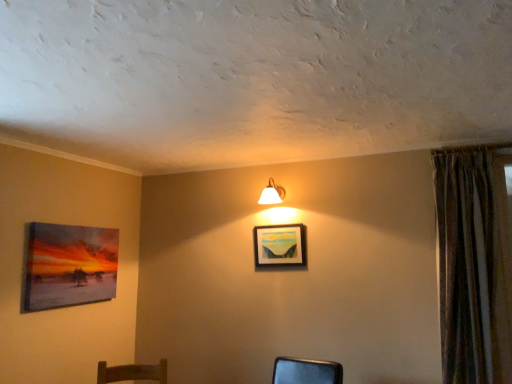
Image resolution: width=512 pixels, height=384 pixels. In order to click on white glossy wall lamp at upper center in this screenshot , I will do `click(272, 193)`.

Image resolution: width=512 pixels, height=384 pixels. Find the location of `matte wooden picture frame at center, which ranks as the first picture frame in right-to-left order`. matte wooden picture frame at center, which ranks as the first picture frame in right-to-left order is located at coordinates (280, 245).

What do you see at coordinates (471, 270) in the screenshot? I see `textured brown curtain at right` at bounding box center [471, 270].

Measure the distance between point (466,265) and camera.

A distance of 2.50 meters exists between point (466,265) and camera.

The image size is (512, 384). Find the location of `white glossy wall lamp at upper center`. white glossy wall lamp at upper center is located at coordinates [272, 193].

Does white glossy wall lamp at upper center have a smaller size compared to matte canvas painting at left, the 2th picture frame viewed from the right?

Yes, white glossy wall lamp at upper center is smaller than matte canvas painting at left, the 2th picture frame viewed from the right.

Where is `lamp that is behind the matte canvas painting at left, the 2th picture frame viewed from the right`? lamp that is behind the matte canvas painting at left, the 2th picture frame viewed from the right is located at coordinates (272, 193).

Which is behind, white glossy wall lamp at upper center or matte canvas painting at left, the 2th picture frame viewed from the right?

white glossy wall lamp at upper center is further from the camera.

Does white glossy wall lamp at upper center turn towards matte canvas painting at left, positioned as the 1th picture frame in left-to-right order?

No, white glossy wall lamp at upper center is not facing towards matte canvas painting at left, positioned as the 1th picture frame in left-to-right order.

The width and height of the screenshot is (512, 384). What are the coordinates of `picture frame above the matte canvas painting at left, positioned as the 1th picture frame in left-to-right order (from a real-world perspective)` in the screenshot? It's located at (280, 245).

Is matte wooden picture frame at center, the second picture frame in the left-to-right sequence, further to the viewer compared to matte canvas painting at left, the 2th picture frame viewed from the right?

Yes, the depth of matte wooden picture frame at center, the second picture frame in the left-to-right sequence, is greater than that of matte canvas painting at left, the 2th picture frame viewed from the right.

From the image's perspective, is matte wooden picture frame at center, the second picture frame in the left-to-right sequence, under matte canvas painting at left, the 2th picture frame viewed from the right?

No.

Is matte wooden picture frame at center, which ranks as the first picture frame in right-to-left order, located within matte canvas painting at left, the 2th picture frame viewed from the right?

No, matte wooden picture frame at center, which ranks as the first picture frame in right-to-left order, is located outside of matte canvas painting at left, the 2th picture frame viewed from the right.

Is matte canvas painting at left, the 2th picture frame viewed from the right, facing towards matte wooden picture frame at center, the second picture frame in the left-to-right sequence?

Yes, matte canvas painting at left, the 2th picture frame viewed from the right, is oriented towards matte wooden picture frame at center, the second picture frame in the left-to-right sequence.

Considering the sizes of objects matte canvas painting at left, the 2th picture frame viewed from the right, and matte wooden picture frame at center, which ranks as the first picture frame in right-to-left order, in the image provided, who is bigger, matte canvas painting at left, the 2th picture frame viewed from the right, or matte wooden picture frame at center, which ranks as the first picture frame in right-to-left order,?

With larger size is matte canvas painting at left, the 2th picture frame viewed from the right.

Is matte canvas painting at left, the 2th picture frame viewed from the right, thinner than matte wooden picture frame at center, the second picture frame in the left-to-right sequence?

No.

Based on their positions, is matte canvas painting at left, the 2th picture frame viewed from the right, located to the left or right of textured brown curtain at right?

Based on their positions, matte canvas painting at left, the 2th picture frame viewed from the right, is located to the left of textured brown curtain at right.

Does matte canvas painting at left, the 2th picture frame viewed from the right, have a lesser height compared to textured brown curtain at right?

Yes, matte canvas painting at left, the 2th picture frame viewed from the right, is shorter than textured brown curtain at right.

Considering the relative sizes of matte canvas painting at left, the 2th picture frame viewed from the right, and textured brown curtain at right in the image provided, is matte canvas painting at left, the 2th picture frame viewed from the right, bigger than textured brown curtain at right?

Incorrect, matte canvas painting at left, the 2th picture frame viewed from the right, is not larger than textured brown curtain at right.

Does point (81, 251) appear closer or farther from the camera than point (444, 347)?

Point (81, 251) is farther from the camera than point (444, 347).

From the picture: Which is closer, (67, 289) or (271, 186)?

The point (67, 289) is closer.

Can you confirm if matte canvas painting at left, the 2th picture frame viewed from the right, is positioned to the left of white glossy wall lamp at upper center?

Yes.

Between matte canvas painting at left, the 2th picture frame viewed from the right, and white glossy wall lamp at upper center, which one has larger width?

With larger width is white glossy wall lamp at upper center.

Which of these two, matte canvas painting at left, positioned as the 1th picture frame in left-to-right order, or white glossy wall lamp at upper center, is bigger?

matte canvas painting at left, positioned as the 1th picture frame in left-to-right order.

Between matte wooden picture frame at center, the second picture frame in the left-to-right sequence, and textured brown curtain at right, which one appears on the right side from the viewer's perspective?

textured brown curtain at right.

Between matte wooden picture frame at center, the second picture frame in the left-to-right sequence, and textured brown curtain at right, which one has smaller width?

With smaller width is matte wooden picture frame at center, the second picture frame in the left-to-right sequence.

Between point (264, 234) and point (488, 199), which one is positioned behind?

Point (264, 234)

Is matte wooden picture frame at center, the second picture frame in the left-to-right sequence, positioned with its back to textured brown curtain at right?

matte wooden picture frame at center, the second picture frame in the left-to-right sequence, does not have its back to textured brown curtain at right.

From a real-world perspective, which is physically above, textured brown curtain at right or matte canvas painting at left, the 2th picture frame viewed from the right?

In real-world perspective, matte canvas painting at left, the 2th picture frame viewed from the right, is above.

Is textured brown curtain at right facing away from matte canvas painting at left, positioned as the 1th picture frame in left-to-right order?

textured brown curtain at right is not turned away from matte canvas painting at left, positioned as the 1th picture frame in left-to-right order.

Considering the sizes of objects textured brown curtain at right and matte canvas painting at left, the 2th picture frame viewed from the right, in the image provided, who is shorter, textured brown curtain at right or matte canvas painting at left, the 2th picture frame viewed from the right,?

matte canvas painting at left, the 2th picture frame viewed from the right, is shorter.

Looking at this image, can you see textured brown curtain at right touching matte canvas painting at left, positioned as the 1th picture frame in left-to-right order?

No, textured brown curtain at right is not making contact with matte canvas painting at left, positioned as the 1th picture frame in left-to-right order.

The height and width of the screenshot is (384, 512). Find the location of `the 2nd picture frame positioned below the white glossy wall lamp at upper center (from the image's perspective)`. the 2nd picture frame positioned below the white glossy wall lamp at upper center (from the image's perspective) is located at coordinates (69, 266).

Find the location of `picture frame above the matte canvas painting at left, the 2th picture frame viewed from the right (from the image's perspective)`. picture frame above the matte canvas painting at left, the 2th picture frame viewed from the right (from the image's perspective) is located at coordinates (280, 245).

Which object lies nearer to the anchor point matte wooden picture frame at center, the second picture frame in the left-to-right sequence, white glossy wall lamp at upper center or matte canvas painting at left, positioned as the 1th picture frame in left-to-right order?

white glossy wall lamp at upper center is closer to matte wooden picture frame at center, the second picture frame in the left-to-right sequence.

Considering their positions, is matte canvas painting at left, positioned as the 1th picture frame in left-to-right order, positioned closer to white glossy wall lamp at upper center than matte wooden picture frame at center, the second picture frame in the left-to-right sequence?

matte wooden picture frame at center, the second picture frame in the left-to-right sequence.

Considering their positions, is matte canvas painting at left, positioned as the 1th picture frame in left-to-right order, positioned closer to matte wooden picture frame at center, which ranks as the first picture frame in right-to-left order, than textured brown curtain at right?

The object closer to matte wooden picture frame at center, which ranks as the first picture frame in right-to-left order, is textured brown curtain at right.

Based on their spatial positions, is white glossy wall lamp at upper center or textured brown curtain at right further from matte canvas painting at left, the 2th picture frame viewed from the right?

textured brown curtain at right is further to matte canvas painting at left, the 2th picture frame viewed from the right.

From the image, which object appears to be farther from matte wooden picture frame at center, the second picture frame in the left-to-right sequence, textured brown curtain at right or white glossy wall lamp at upper center?

textured brown curtain at right lies further to matte wooden picture frame at center, the second picture frame in the left-to-right sequence, than the other object.

From the picture: When comparing their distances from textured brown curtain at right, does matte canvas painting at left, the 2th picture frame viewed from the right, or matte wooden picture frame at center, the second picture frame in the left-to-right sequence, seem closer?

matte wooden picture frame at center, the second picture frame in the left-to-right sequence.

Looking at the image, which one is located further to matte canvas painting at left, the 2th picture frame viewed from the right, white glossy wall lamp at upper center or matte wooden picture frame at center, the second picture frame in the left-to-right sequence?

Based on the image, white glossy wall lamp at upper center appears to be further to matte canvas painting at left, the 2th picture frame viewed from the right.

From the image, which object appears to be nearer to matte canvas painting at left, the 2th picture frame viewed from the right, matte wooden picture frame at center, the second picture frame in the left-to-right sequence, or textured brown curtain at right?

Among the two, matte wooden picture frame at center, the second picture frame in the left-to-right sequence, is located nearer to matte canvas painting at left, the 2th picture frame viewed from the right.

This screenshot has height=384, width=512. I want to click on lamp located between matte canvas painting at left, the 2th picture frame viewed from the right, and textured brown curtain at right in the left-right direction, so click(272, 193).

This screenshot has width=512, height=384. I want to click on picture frame between matte canvas painting at left, the 2th picture frame viewed from the right, and textured brown curtain at right, in the horizontal direction, so click(x=280, y=245).

Locate an element on the screen. picture frame between white glossy wall lamp at upper center and textured brown curtain at right in the horizontal direction is located at coordinates (280, 245).

At what (x,y) coordinates should I click in order to perform the action: click on lamp situated between matte canvas painting at left, positioned as the 1th picture frame in left-to-right order, and matte wooden picture frame at center, which ranks as the first picture frame in right-to-left order, from left to right. Please return your answer as a coordinate pair (x, y). The width and height of the screenshot is (512, 384). Looking at the image, I should click on (272, 193).